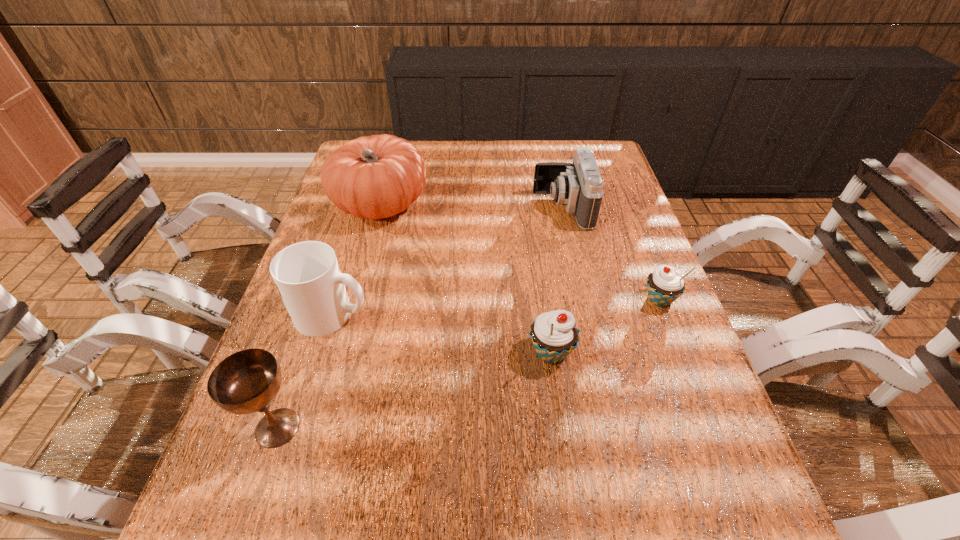
I want to click on the nearer cupcake, so click(554, 334).

What are the coordinates of `the taller cupcake` in the screenshot? It's located at (554, 334).

The height and width of the screenshot is (540, 960). Identify the location of the farther cupcake. 664,285.

Where is `the shorter cupcake`? The image size is (960, 540). the shorter cupcake is located at coordinates (664, 285).

Find the location of `camera`. camera is located at coordinates (578, 186).

Identify the location of mug. (307, 275).

Where is `pumpkin`? pumpkin is located at coordinates (374, 177).

Find the location of a particular element. The height and width of the screenshot is (540, 960). the nearest object is located at coordinates (247, 381).

Find the location of a particular element. The image size is (960, 540). free space located 0.150m on the back of the left cupcake is located at coordinates (541, 284).

I want to click on vacant space situated on the left of the right cupcake, so click(x=497, y=300).